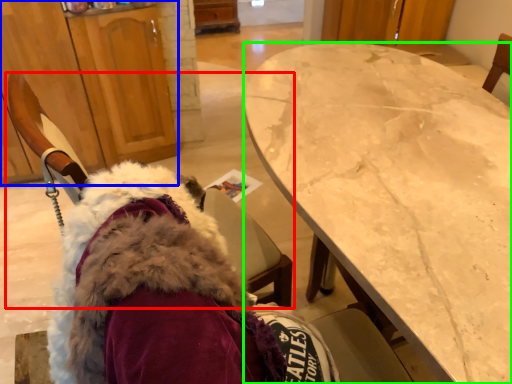
Question: Considering the real-world distances, which object is farthest from chair (highlighted by a red box)? cabinetry (highlighted by a blue box) or desk (highlighted by a green box)?

Choices:
 (A) cabinetry
 (B) desk

Answer: (A)